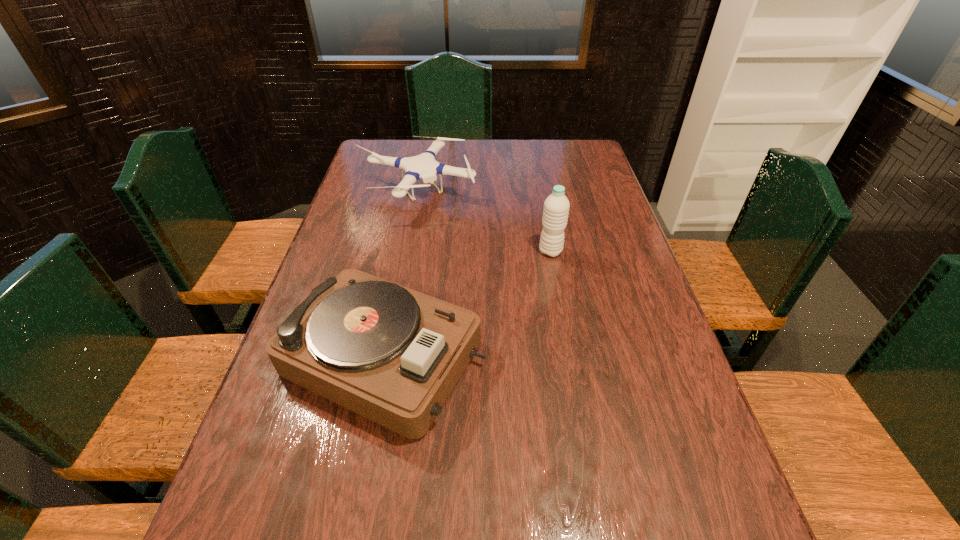
Point out which object is positioned as the nearest to the farthest object. Please provide its 2D coordinates. Your answer should be formatted as a tuple, i.e. [(x, y)], where the tuple contains the x and y coordinates of a point satisfying the conditions above.

[(556, 207)]

Find the location of a particular element. object that stands as the closest to the nearest object is located at coordinates (556, 207).

Where is `vacant area in the image that satisfies the following two spatial constraints: 1. on the front side of the nearest object; 2. on the left side of the drone`? This screenshot has width=960, height=540. vacant area in the image that satisfies the following two spatial constraints: 1. on the front side of the nearest object; 2. on the left side of the drone is located at coordinates (383, 357).

Where is `free point that satisfies the following two spatial constraints: 1. on the back side of the nearest object; 2. on the left side of the rightmost object`? Image resolution: width=960 pixels, height=540 pixels. free point that satisfies the following two spatial constraints: 1. on the back side of the nearest object; 2. on the left side of the rightmost object is located at coordinates (405, 251).